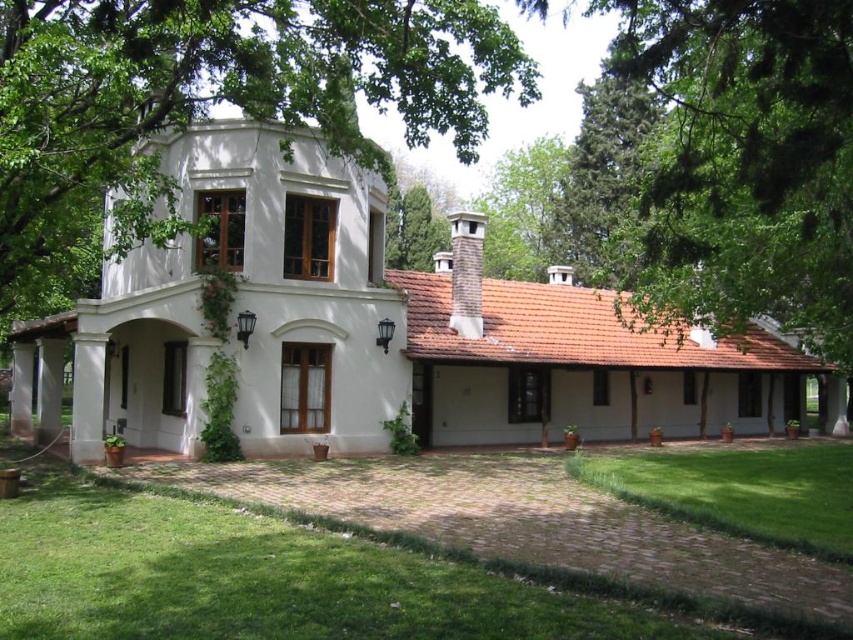
Can you confirm if green leafy tree at upper center is positioned to the left of green grass lawn at lower right?

Correct, you'll find green leafy tree at upper center to the left of green grass lawn at lower right.

Where is `green leafy tree at upper center`? green leafy tree at upper center is located at coordinates (209, 104).

Between point (306, 56) and point (759, 513), which one is positioned behind?

The point (306, 56) is behind.

The image size is (853, 640). I want to click on green leafy tree at upper center, so click(209, 104).